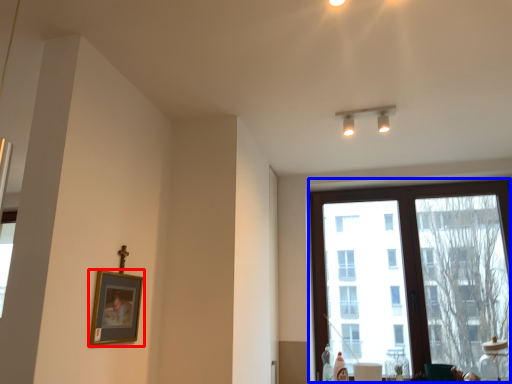
Question: Among these objects, which one is nearest to the camera, picture frame (highlighted by a red box) or window (highlighted by a blue box)?

Choices:
 (A) picture frame
 (B) window

Answer: (A)